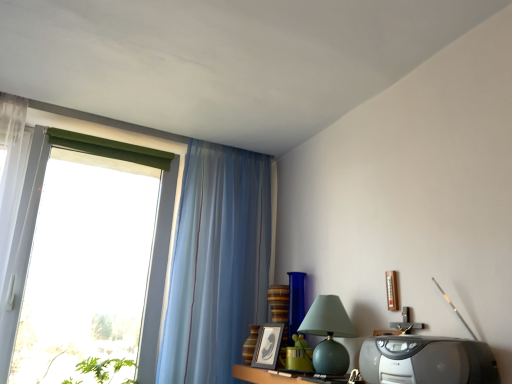
Find the location of a particular element. The image size is (512, 384). space that is in front of black matte picture frame at center is located at coordinates (278, 371).